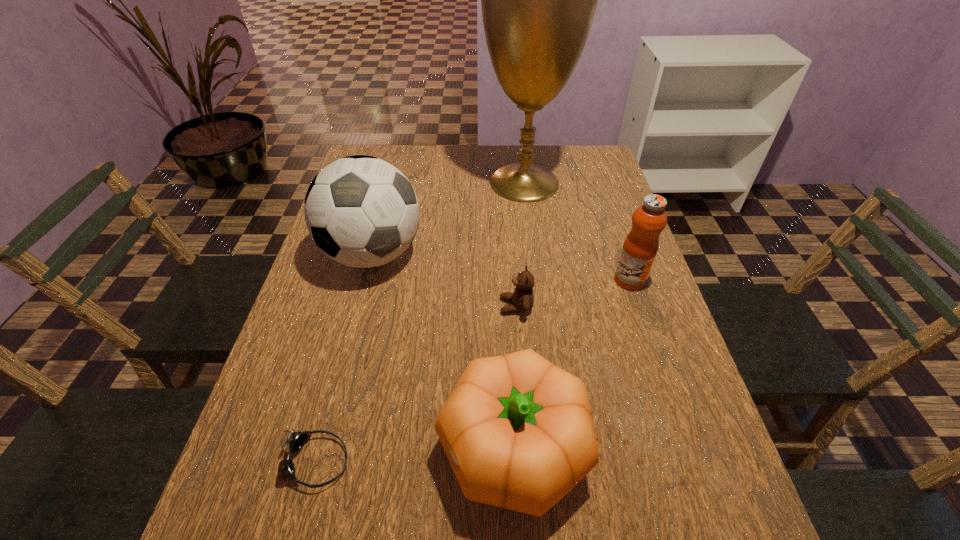
At what (x,y) coordinates should I click in order to perform the action: click on trophy cup that is positioned at the right edge. Please return your answer as a coordinate pair (x, y). The width and height of the screenshot is (960, 540). Looking at the image, I should click on (538, 0).

Find the location of a particular element. The image size is (960, 540). fruit juice that is positioned at the right edge is located at coordinates (640, 247).

Locate an element on the screen. object that is at the far right corner is located at coordinates (538, 0).

Locate an element on the screen. The width and height of the screenshot is (960, 540). blank space at the far edge of the desktop is located at coordinates (443, 175).

Find the location of a particular element. free space at the left edge is located at coordinates (255, 416).

Where is `vacant region at the right edge`? vacant region at the right edge is located at coordinates (601, 216).

Where is `free spot at the far left corner of the desktop`? The image size is (960, 540). free spot at the far left corner of the desktop is located at coordinates (399, 158).

The width and height of the screenshot is (960, 540). I want to click on vacant position at the far right corner of the desktop, so click(558, 152).

I want to click on vacant area that lies between the goggles and the soccer ball, so click(x=344, y=358).

Where is `free space that is in between the pumpkin and the goggles`? The width and height of the screenshot is (960, 540). free space that is in between the pumpkin and the goggles is located at coordinates (x=414, y=456).